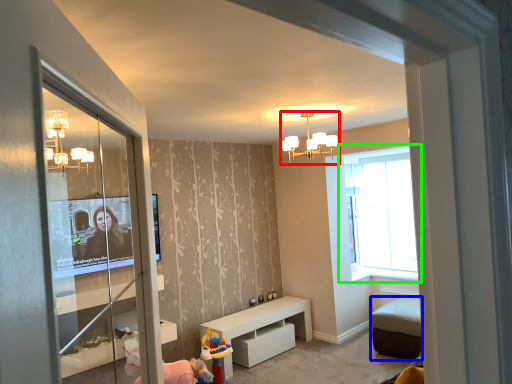
Question: Which object is the farthest from light fixture (highlighted by a red box)? Choose among these: furniture (highlighted by a blue box) or window (highlighted by a green box).

Choices:
 (A) furniture
 (B) window

Answer: (A)